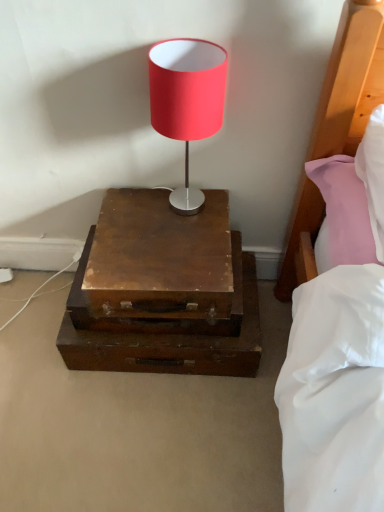
Find the location of a particular element. Image resolution: width=384 pixels, height=512 pixels. space that is in front of matte red lampshade at center is located at coordinates tap(173, 255).